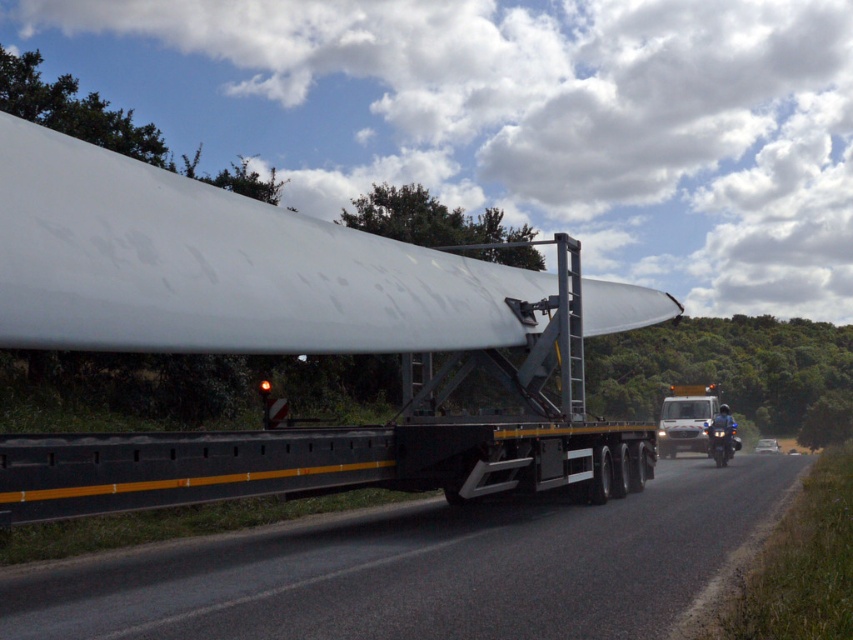
Does white matte wind turbine blade at center come behind black asphalt road at center?

Yes, it is behind black asphalt road at center.

Is point (373, 301) positioned after point (115, 620)?

That is True.

You are a GUI agent. You are given a task and a screenshot of the screen. Output one action in this format:
    pyautogui.click(x=<x>, y=<y>)
    Task: Click on the white matte wind turbine blade at center
    The height and width of the screenshot is (640, 853).
    Given the screenshot: What is the action you would take?
    pyautogui.click(x=288, y=339)